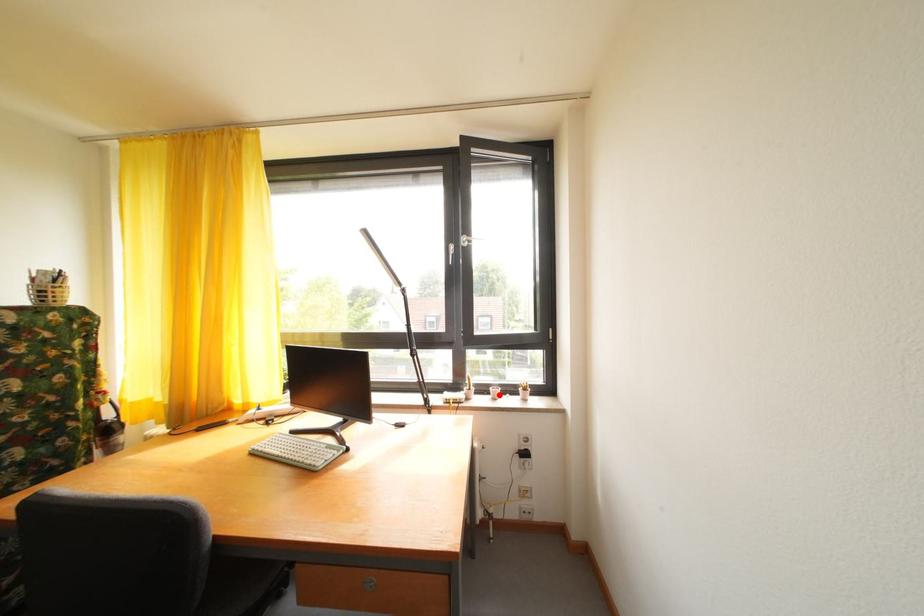
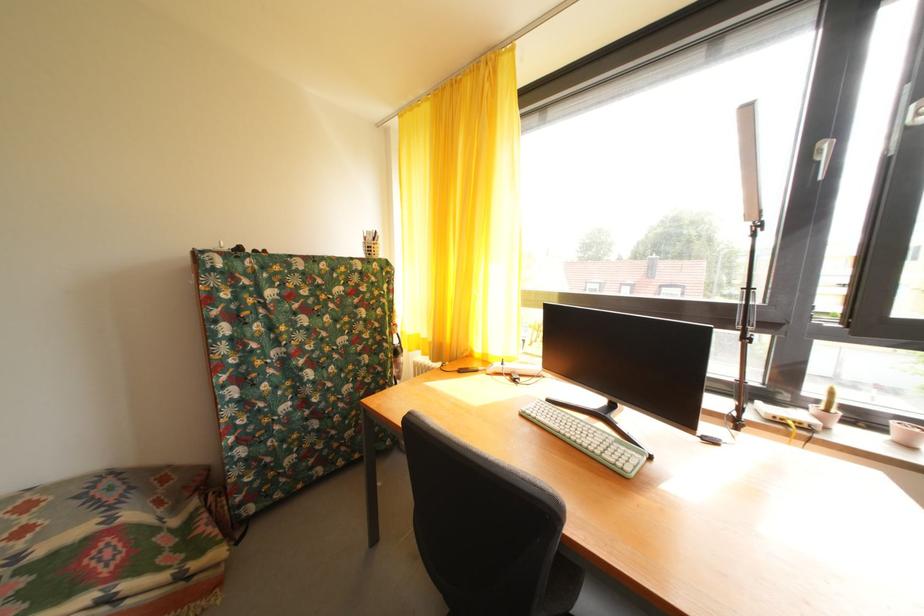
Question: I am providing you with two images of the same scene from different viewpoints. In image1, a red point is highlighted. Considering the same 3D point in image2, which of the following is correct?

Choices:
 (A) It is closer
 (B) It is farther

Answer: (A)